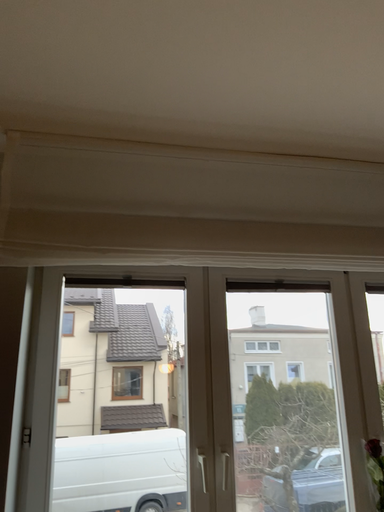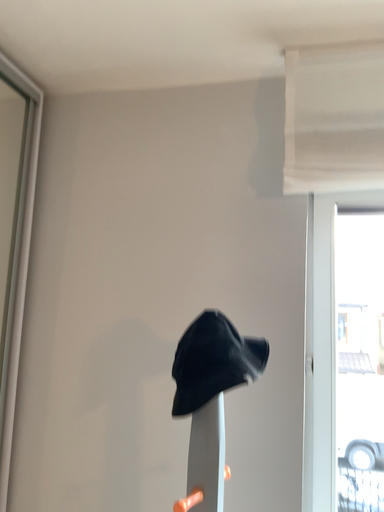
Question: How did the camera likely rotate when shooting the video?

Choices:
 (A) rotated left
 (B) rotated right

Answer: (A)